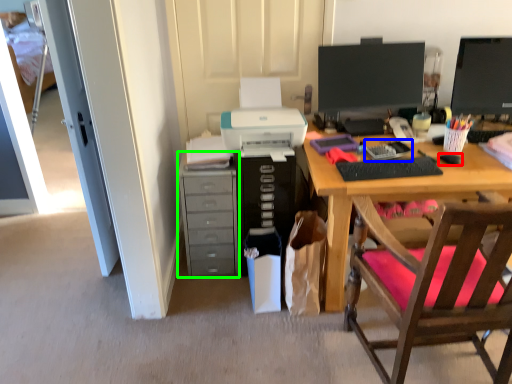
Question: Which object is positioned farthest from mouse (highlighted by a red box)? Select from office supplies (highlighted by a blue box) and cabinetry (highlighted by a green box).

Choices:
 (A) office supplies
 (B) cabinetry

Answer: (B)